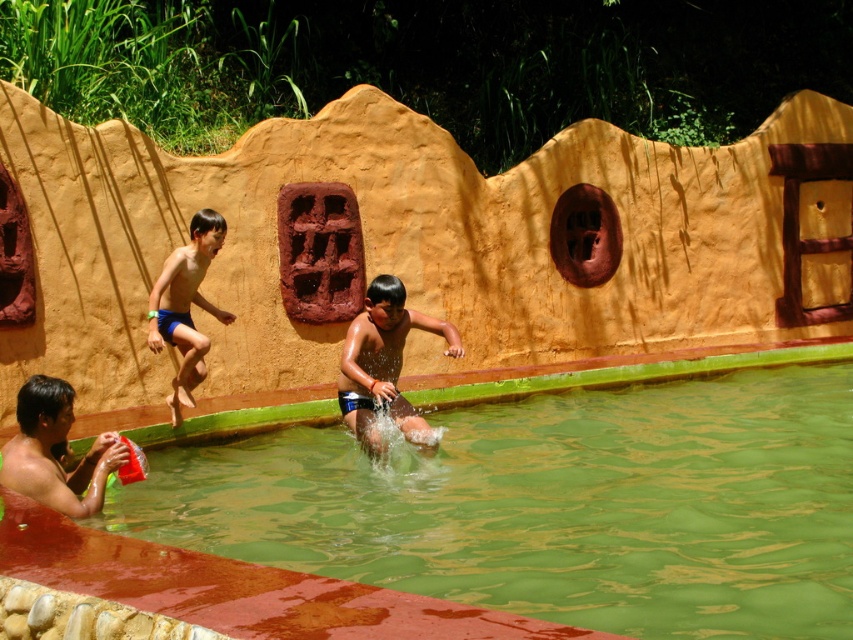
Describe the element at coordinates (235, 588) in the screenshot. This screenshot has height=640, width=853. I see `green smooth water at center` at that location.

Is green smooth water at center smaller than blue shorts at left?

Actually, green smooth water at center might be larger than blue shorts at left.

At what (x,y) coordinates should I click in order to perform the action: click on green smooth water at center. Please return your answer as a coordinate pair (x, y). The image size is (853, 640). Looking at the image, I should click on point(235,588).

Is point (483, 616) in front of point (6, 461)?

Yes, it is in front of point (6, 461).

Identify the location of green smooth water at center. (235, 588).

Can you confirm if smooth skin man at lower left is positioned to the left of blue shorts at left?

Indeed, smooth skin man at lower left is positioned on the left side of blue shorts at left.

Describe the element at coordinates (51, 452) in the screenshot. I see `smooth skin man at lower left` at that location.

In order to click on smooth skin man at lower left in this screenshot , I will do `click(51, 452)`.

Where is `smooth skin man at lower left`? smooth skin man at lower left is located at coordinates (51, 452).